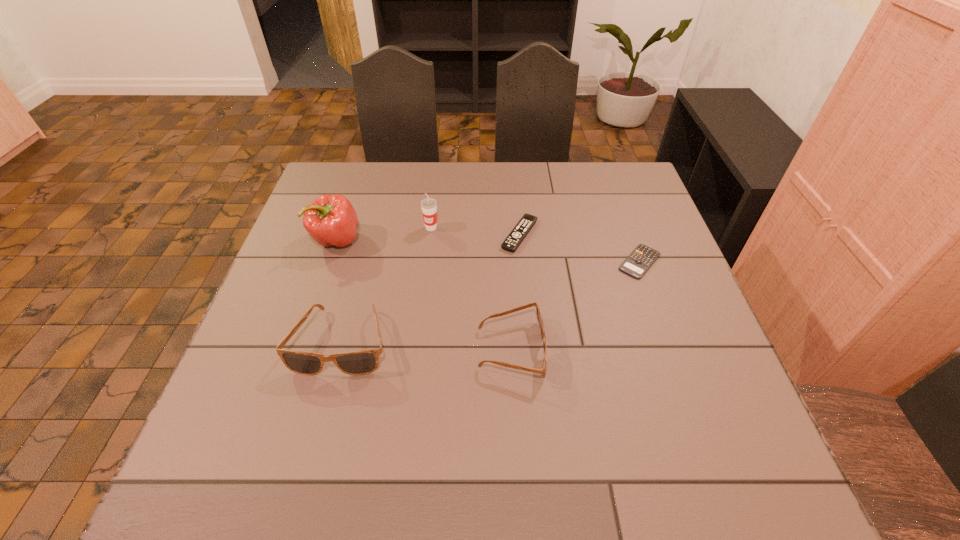
Locate an element on the screen. The height and width of the screenshot is (540, 960). free point between the pepper and the left sunglasses is located at coordinates (339, 291).

Where is `empty location between the shortest object and the fifth tallest object`? The image size is (960, 540). empty location between the shortest object and the fifth tallest object is located at coordinates (580, 248).

Identify the location of the third closest object to the third object from left to right. This screenshot has height=540, width=960. (362, 362).

The image size is (960, 540). I want to click on object that is the fifth closest to the fourth tallest object, so click(331, 220).

The width and height of the screenshot is (960, 540). Identify the location of vacant region that satisfies the following two spatial constraints: 1. on the front side of the rightmost object; 2. on the right side of the second shortest object. (522, 262).

Locate an element on the screen. free space that satisfies the following two spatial constraints: 1. on the front side of the rightmost object; 2. on the frames of the shorter sunglasses is located at coordinates (671, 349).